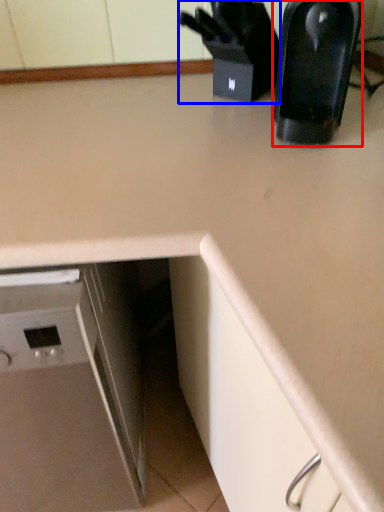
Question: Which point is further to the camera, kitchen appliance (highlighted by a red box) or appliance (highlighted by a blue box)?

Choices:
 (A) kitchen appliance
 (B) appliance

Answer: (B)